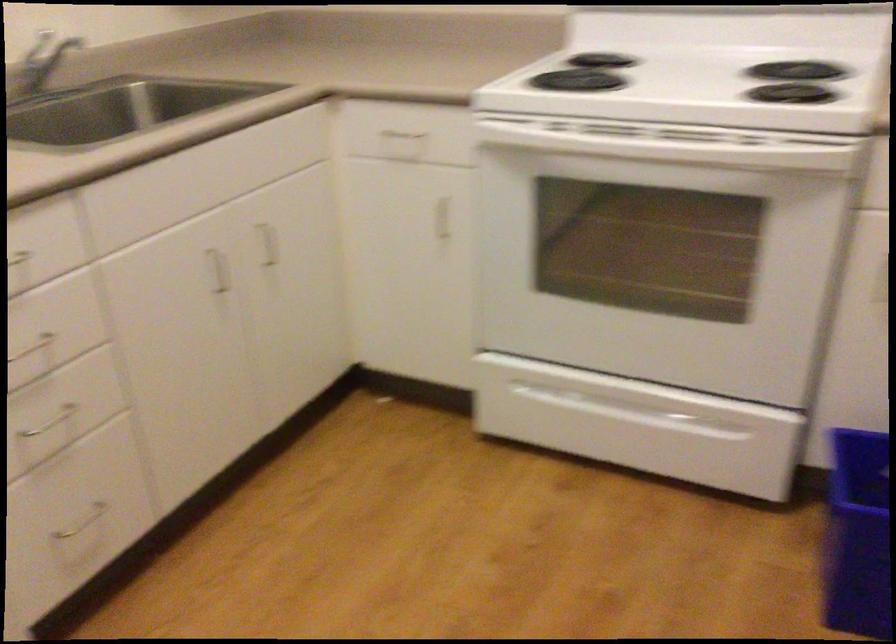
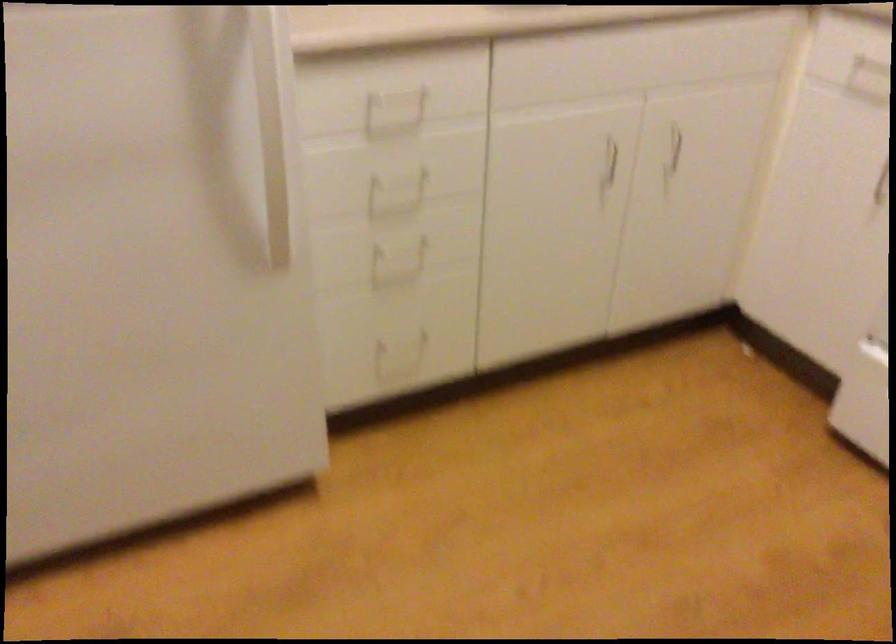
Find the pixel in the second image that matches point 218,277 in the first image.

(609, 161)